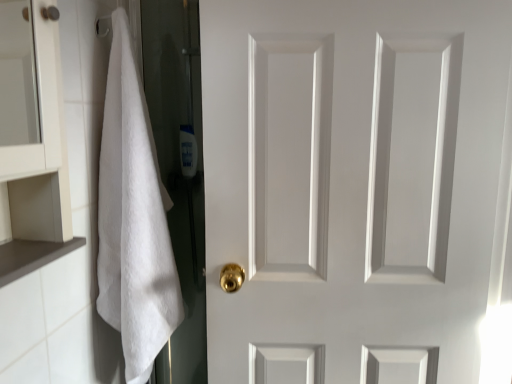
What do you see at coordinates (133, 219) in the screenshot? The image size is (512, 384). I see `white fluffy towel at left` at bounding box center [133, 219].

This screenshot has width=512, height=384. In order to click on brown matte cabinet at lower left in this screenshot , I will do [31, 256].

Locate an element on the screen. This screenshot has height=384, width=512. white fluffy towel at left is located at coordinates (133, 219).

From a real-world perspective, is translucent plastic bottle at center on white fluffy towel at left?

Yes, from a real-world perspective, translucent plastic bottle at center is above white fluffy towel at left.

Which object is further away from the camera, translucent plastic bottle at center or white fluffy towel at left?

translucent plastic bottle at center.

In the scene shown: How different are the orientations of translucent plastic bottle at center and white fluffy towel at left in degrees?

4.71 degrees.

Is translucent plastic bottle at center inside the boundaries of white fluffy towel at left, or outside?

translucent plastic bottle at center cannot be found inside white fluffy towel at left.

Identify the location of bath towel that is on the right side of brown matte cabinet at lower left. The width and height of the screenshot is (512, 384). (133, 219).

From a real-world perspective, who is located higher, white fluffy towel at left or brown matte cabinet at lower left?

brown matte cabinet at lower left is physically above.

Considering the positions of points (166, 340) and (28, 245), is point (166, 340) farther from camera compared to point (28, 245)?

That is True.

Does white fluffy towel at left turn towards brown matte cabinet at lower left?

No, white fluffy towel at left does not turn towards brown matte cabinet at lower left.

Would you say white matte door at center is a long distance from white fluffy towel at left?

No, white matte door at center is in close proximity to white fluffy towel at left.

Would you say white matte door at center is outside white fluffy towel at left?

Yes, white matte door at center is not within white fluffy towel at left.

Considering their positions, is white matte door at center located in front of or behind white fluffy towel at left?

In the image, white matte door at center appears behind white fluffy towel at left.

Can you confirm if white matte door at center is smaller than translucent plastic bottle at center?

Actually, white matte door at center might be larger than translucent plastic bottle at center.

Considering the relative sizes of white matte door at center and translucent plastic bottle at center in the image provided, is white matte door at center taller than translucent plastic bottle at center?

Yes.

Considering the points (262, 25) and (191, 150), which point is behind, point (262, 25) or point (191, 150)?

The point (191, 150) is more distant.

Find the location of a particular element. door on the right of translucent plastic bottle at center is located at coordinates pyautogui.click(x=358, y=190).

Are translucent plastic bottle at center and brown matte cabinet at lower left located far from each other?

No, translucent plastic bottle at center is in close proximity to brown matte cabinet at lower left.

Considering the relative positions of translucent plastic bottle at center and brown matte cabinet at lower left in the image provided, is translucent plastic bottle at center to the left of brown matte cabinet at lower left from the viewer's perspective?

No.

From a real-world perspective, between translucent plastic bottle at center and brown matte cabinet at lower left, who is vertically higher?

translucent plastic bottle at center, from a real-world perspective.

In the scene shown: Which is closer to the camera, (193, 130) or (70, 247)?

The point (70, 247) is closer.

From the image's perspective, relative to translucent plastic bottle at center, is brown matte cabinet at lower left above or below?

Clearly, from the image's perspective, brown matte cabinet at lower left is below translucent plastic bottle at center.

In terms of size, does brown matte cabinet at lower left appear bigger or smaller than translucent plastic bottle at center?

brown matte cabinet at lower left is smaller than translucent plastic bottle at center.

Considering the positions of objects brown matte cabinet at lower left and translucent plastic bottle at center in the image provided, who is more to the left, brown matte cabinet at lower left or translucent plastic bottle at center?

brown matte cabinet at lower left.

Where is `cabinet in front of the translucent plastic bottle at center`? cabinet in front of the translucent plastic bottle at center is located at coordinates (31, 256).

From the image's perspective, is white fluffy towel at left above white matte door at center?

Incorrect, from the image's perspective, white fluffy towel at left is lower than white matte door at center.

How far apart are white fluffy towel at left and white matte door at center?

white fluffy towel at left and white matte door at center are 15.77 inches apart from each other.

From a real-world perspective, which is physically below, white fluffy towel at left or white matte door at center?

white fluffy towel at left, from a real-world perspective.

Considering the relative positions of white fluffy towel at left and white matte door at center in the image provided, is white fluffy towel at left to the left or to the right of white matte door at center?

In the image, white fluffy towel at left appears on the left side of white matte door at center.

I want to click on bath towel in front of the translucent plastic bottle at center, so click(x=133, y=219).

Identify the location of bath towel behind the brown matte cabinet at lower left. (133, 219).

Considering their positions, is white matte door at center positioned closer to brown matte cabinet at lower left than white fluffy towel at left?

white fluffy towel at left lies closer to brown matte cabinet at lower left than the other object.

Considering their positions, is translucent plastic bottle at center positioned closer to white fluffy towel at left than brown matte cabinet at lower left?

Among the two, brown matte cabinet at lower left is located nearer to white fluffy towel at left.

Estimate the real-world distances between objects in this image. Which object is closer to white fluffy towel at left, white matte door at center or translucent plastic bottle at center?

white matte door at center is closer to white fluffy towel at left.

When comparing their distances from translucent plastic bottle at center, does white fluffy towel at left or brown matte cabinet at lower left seem further?

brown matte cabinet at lower left is positioned further to the anchor translucent plastic bottle at center.

In the scene shown: Looking at the image, which one is located closer to brown matte cabinet at lower left, white matte door at center or translucent plastic bottle at center?

white matte door at center lies closer to brown matte cabinet at lower left than the other object.

Looking at the image, which one is located further to brown matte cabinet at lower left, white fluffy towel at left or white matte door at center?

Based on the image, white matte door at center appears to be further to brown matte cabinet at lower left.

Which object lies further to the anchor point brown matte cabinet at lower left, translucent plastic bottle at center or white matte door at center?

Among the two, translucent plastic bottle at center is located further to brown matte cabinet at lower left.

Estimate the real-world distances between objects in this image. Which object is closer to white fluffy towel at left, brown matte cabinet at lower left or translucent plastic bottle at center?

Based on the image, brown matte cabinet at lower left appears to be nearer to white fluffy towel at left.

The width and height of the screenshot is (512, 384). In order to click on bath towel situated between brown matte cabinet at lower left and white matte door at center from left to right in this screenshot , I will do `click(133, 219)`.

Identify the location of bath towel between brown matte cabinet at lower left and translucent plastic bottle at center from front to back. (133, 219).

In order to click on door between white fluffy towel at left and translucent plastic bottle at center along the z-axis in this screenshot , I will do `click(358, 190)`.

Locate an element on the screen. door located between brown matte cabinet at lower left and translucent plastic bottle at center in the depth direction is located at coordinates (358, 190).